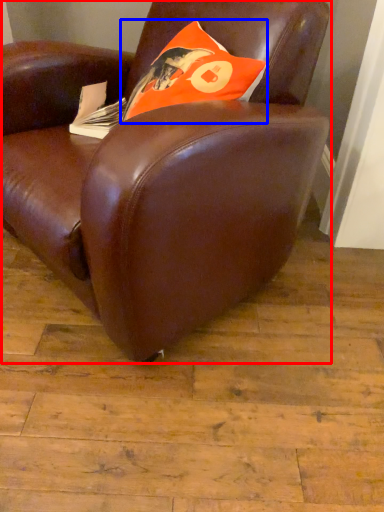
Question: Which object appears closest to the camera in this image, chair (highlighted by a red box) or throw pillow (highlighted by a blue box)?

Choices:
 (A) chair
 (B) throw pillow

Answer: (A)